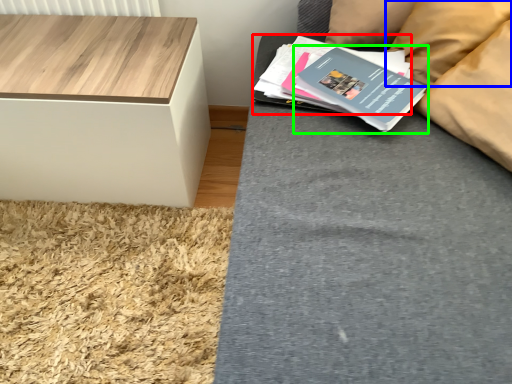
Question: Which object is the farthest from paperback book (highlighted by a red box)? Choose among these: pillow (highlighted by a blue box) or paperback book (highlighted by a green box).

Choices:
 (A) pillow
 (B) paperback book

Answer: (A)